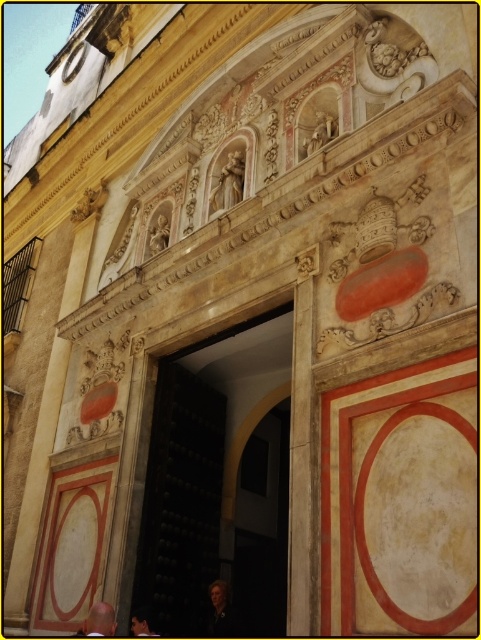
You are a visitor approaching the historical building and notice both the dark wood door at center and the dark brown leather jacket at lower left. From your perspective, which object is closer to you?

The dark wood door at center is closer to you because the dark brown leather jacket at lower left is behind it.